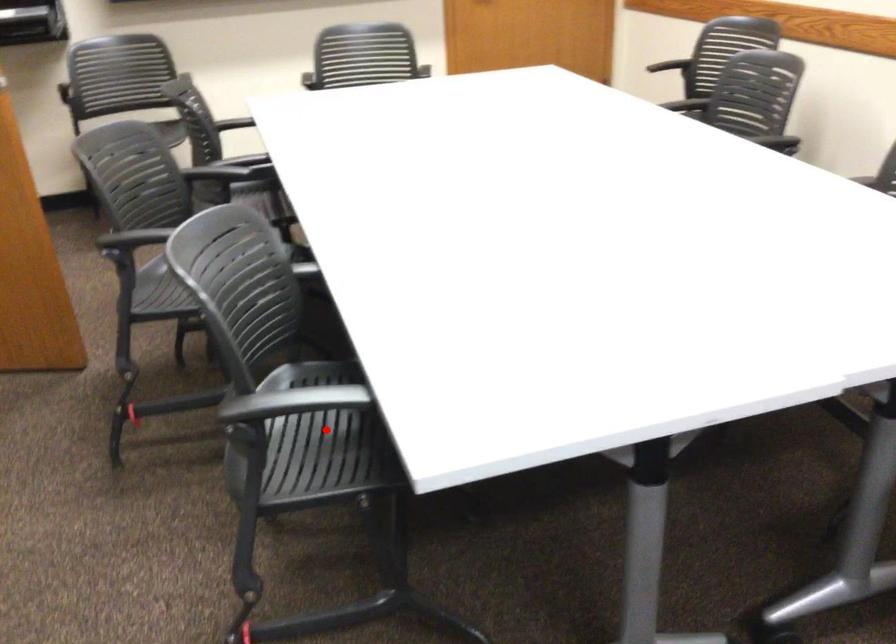
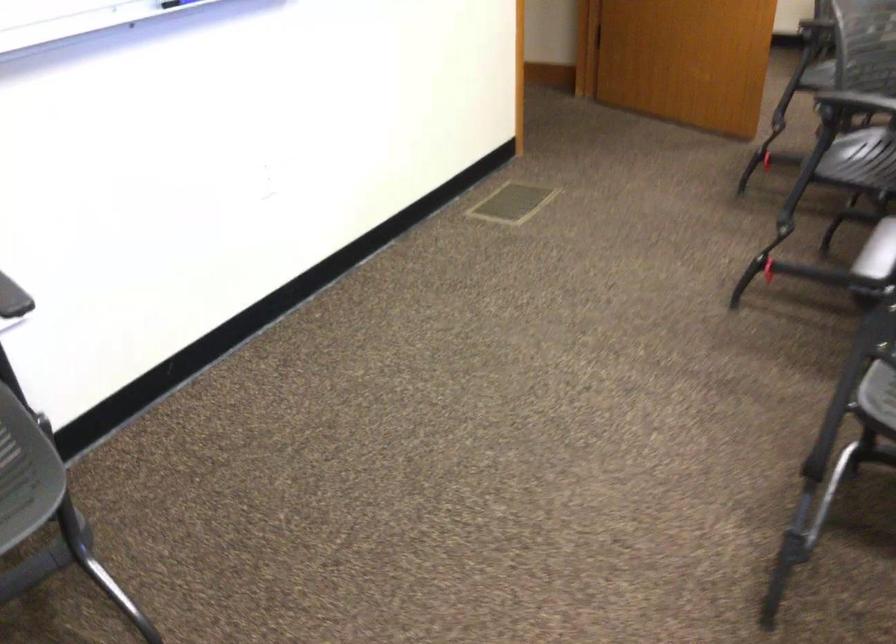
Where in the second image is the point corresponding to the highlighted location from the first image?

(860, 160)